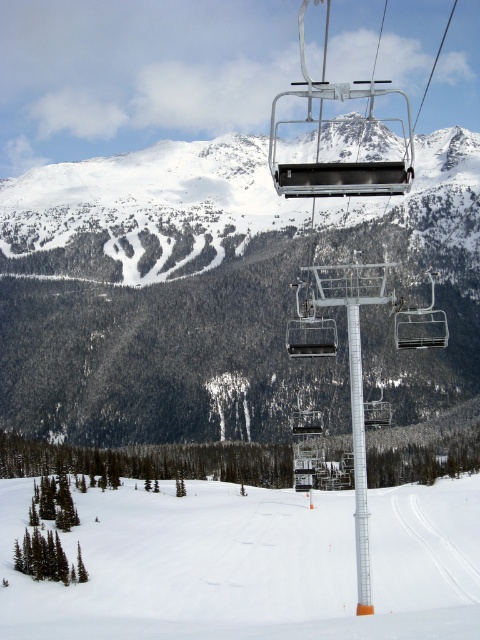
You are a skier planning to take a break at the white plastic pole at center. Looking at the image, which direction should you head to reach the white snow ski slope at lower left from your current position?

You should head to the left to reach the white snow ski slope at lower left from the white plastic pole at center because the white snow ski slope at lower left is located to the left of the white plastic pole at center.

You are a skier planning to take a photo of the snowy forested mountain at center and the white snow ski slope at lower left from the chairlift. Which object will appear larger in your photo?

The snowy forested mountain at center will appear larger in the photo because it is taller than the white snow ski slope at lower left.

You are planning to install a new ski lift station. The existing lift poles are located at coordinates between 0.7 and 0.9 on the x and y axes. Is the white snow ski slope at lower left a suitable location for the new station?

The white snow ski slope at lower left is located at coordinates (251, 564), which falls within the existing lift pole area between 0.7 and 0.9 on both axes. Therefore, it is a suitable location for the new station.